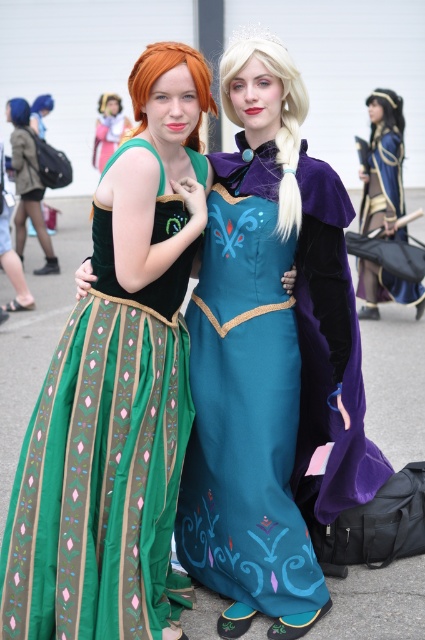
Question: Does velvet blue cape at center have a lesser width compared to matte green dress at center?

Choices:
 (A) yes
 (B) no

Answer: (A)

Question: Does teal satin dress at center appear over green satin dress at left?

Choices:
 (A) no
 (B) yes

Answer: (B)

Question: Which object is positioned closest to the matte green dress at center?

Choices:
 (A) teal satin dress at center
 (B) green satin dress at left

Answer: (A)

Question: Estimate the real-world distances between objects in this image. Which object is closer to the matte green dress at center?

Choices:
 (A) teal satin dress at center
 (B) green satin dress at left
 (C) velvet blue cape at center

Answer: (C)

Question: Is teal satin dress at center positioned before matte green dress at center?

Choices:
 (A) no
 (B) yes

Answer: (B)

Question: Which point is closer to the camera?

Choices:
 (A) (95, 138)
 (B) (288, 380)

Answer: (B)